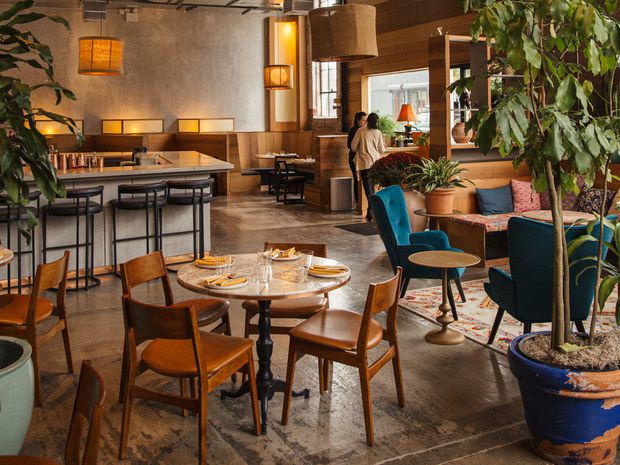
Locate an element on the screen. This screenshot has width=620, height=465. wooden chairs is located at coordinates (33, 301), (204, 311), (215, 344), (339, 339), (297, 304).